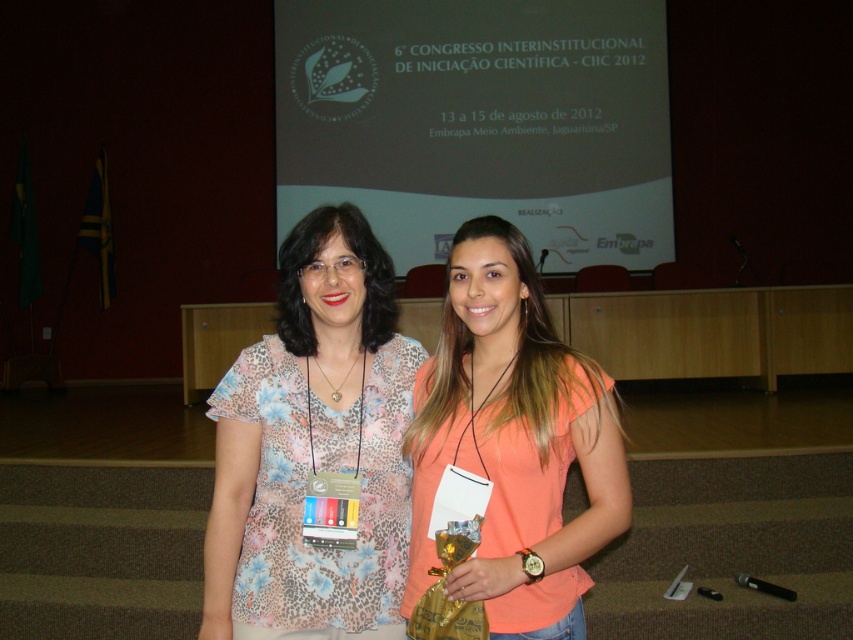
Question: Among these objects, which one is nearest to the camera?

Choices:
 (A) orange matte shirt at center
 (B) matte white projector screen at upper center

Answer: (A)

Question: Which object is closer to the camera taking this photo?

Choices:
 (A) floral print blouse at center
 (B) orange matte shirt at center
 (C) matte white projector screen at upper center

Answer: (B)

Question: Can you confirm if matte white projector screen at upper center is bigger than orange matte shirt at center?

Choices:
 (A) yes
 (B) no

Answer: (A)

Question: Which point is closer to the camera?

Choices:
 (A) (546, 209)
 (B) (241, 376)
 (C) (526, 308)

Answer: (C)

Question: Is matte white projector screen at upper center positioned in front of floral print blouse at center?

Choices:
 (A) yes
 (B) no

Answer: (B)

Question: Does matte white projector screen at upper center have a lesser width compared to orange matte shirt at center?

Choices:
 (A) yes
 (B) no

Answer: (B)